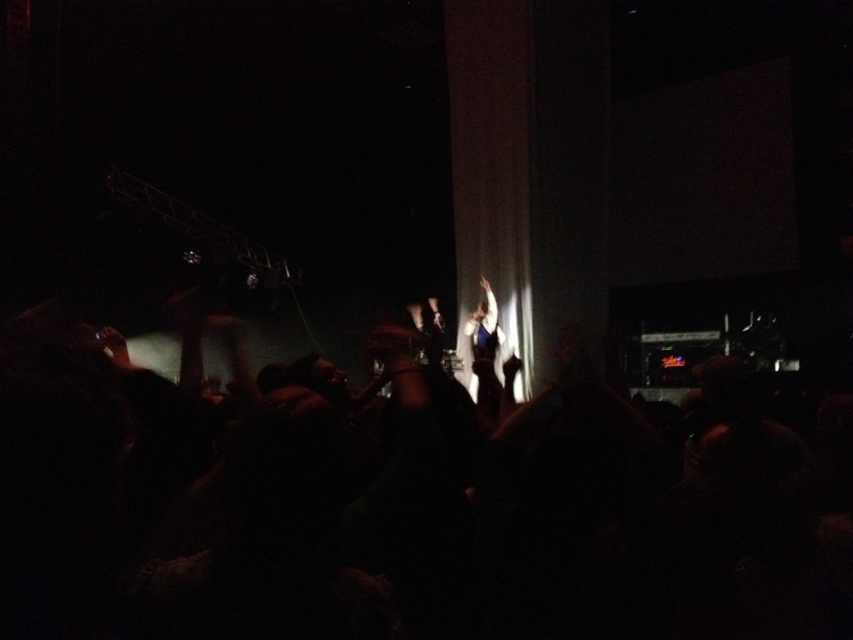
Which is below, black fabric crowd at center or shiny blue dress at center?

black fabric crowd at center is lower down.

Can you confirm if black fabric crowd at center is positioned above shiny blue dress at center?

No, black fabric crowd at center is not above shiny blue dress at center.

Does point (552, 602) come behind point (485, 278)?

No, it is in front of (485, 278).

Where is `black fabric crowd at center`? This screenshot has height=640, width=853. black fabric crowd at center is located at coordinates (412, 513).